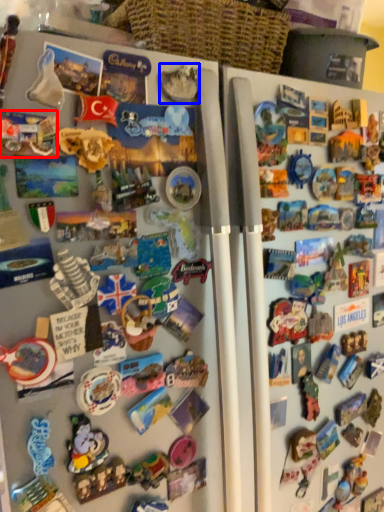
Question: Which object is closer to the camera taking this photo, toy (highlighted by a red box) or toy (highlighted by a blue box)?

Choices:
 (A) toy
 (B) toy

Answer: (A)